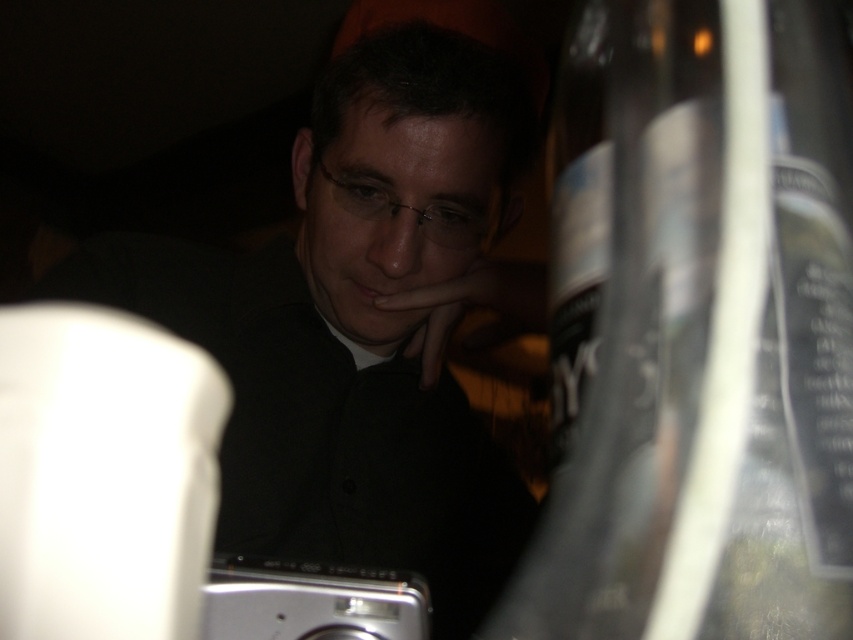
You are a photographer trying to adjust the lighting for a portrait. You notice a bright light source near the camera. Where is the point at coordinates point (357,324) located on the subject?

The point at coordinates point (357,324) is located on the matte black shirt at center, so the light source is casting a bright highlight on the subject at that position.

You are a photographer trying to adjust the lighting for a portrait. You notice the matte black shirt at center and the silver metallic camera at lower center in your frame. Which object appears taller in the photo?

The matte black shirt at center appears taller than the silver metallic camera at lower center in the photo.